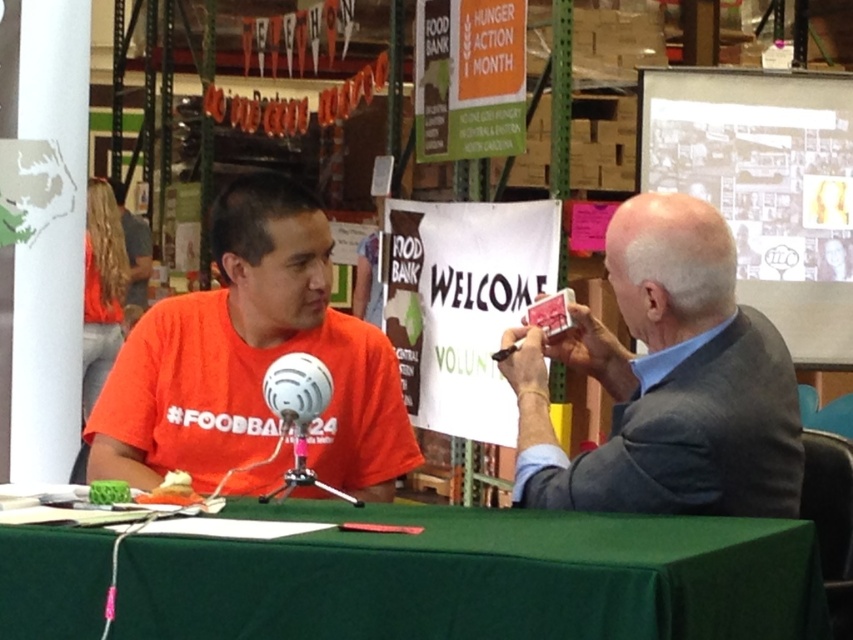
Is gray fabric suit at right shorter than orange matte shirt at center?

Correct, gray fabric suit at right is not as tall as orange matte shirt at center.

Which is below, gray fabric suit at right or orange matte shirt at center?

Positioned lower is orange matte shirt at center.

Who is more forward, (671, 481) or (343, 358)?

Point (671, 481)

Where is `gray fabric suit at right`? This screenshot has width=853, height=640. gray fabric suit at right is located at coordinates (666, 381).

Which is more to the right, green fabric table at center or gray fabric suit at right?

From the viewer's perspective, gray fabric suit at right appears more on the right side.

From the picture: Who is positioned more to the left, green fabric table at center or gray fabric suit at right?

Positioned to the left is green fabric table at center.

Between point (433, 595) and point (697, 429), which one is positioned in front?

Positioned in front is point (433, 595).

Identify the location of green fabric table at center. (476, 577).

Where is `green fabric table at center`? The height and width of the screenshot is (640, 853). green fabric table at center is located at coordinates (476, 577).

Is green fabric table at center below orange matte shirt at center?

Correct, green fabric table at center is located below orange matte shirt at center.

At what (x,y) coordinates should I click in order to perform the action: click on green fabric table at center. Please return your answer as a coordinate pair (x, y). This screenshot has height=640, width=853. Looking at the image, I should click on (476, 577).